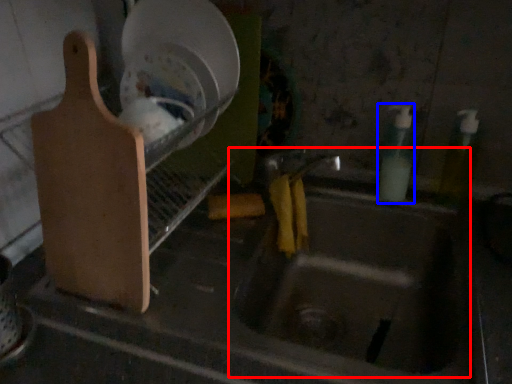
Question: Among these objects, which one is nearest to the camera, sink (highlighted by a red box) or bottle (highlighted by a blue box)?

Choices:
 (A) sink
 (B) bottle

Answer: (A)